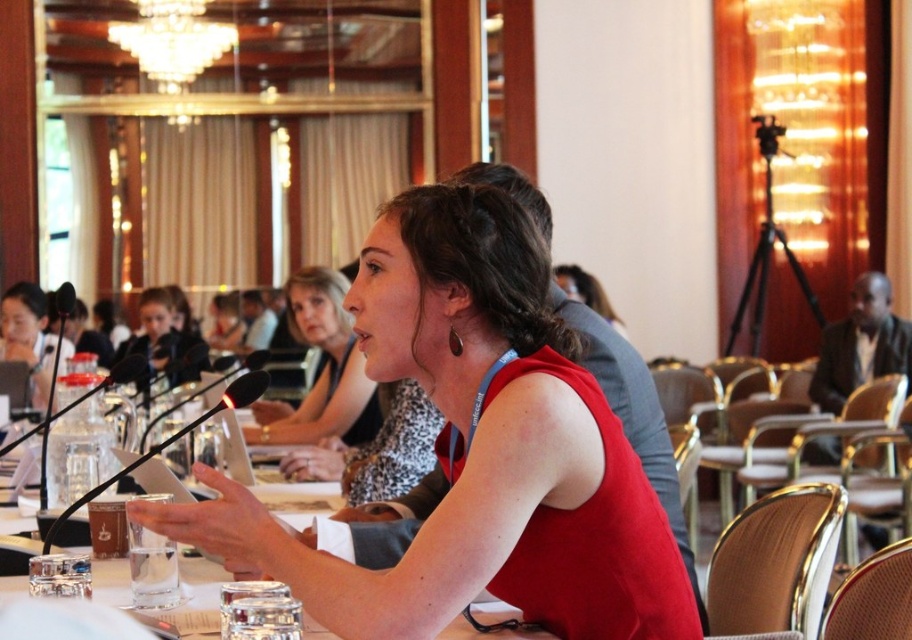
Image resolution: width=912 pixels, height=640 pixels. What do you see at coordinates (320, 371) in the screenshot?
I see `red satin dress at center` at bounding box center [320, 371].

Which is more to the right, red satin dress at center or matte black microphone at upper left?

red satin dress at center is more to the right.

Who is more forward, (314, 268) or (161, 332)?

Positioned in front is point (314, 268).

Locate an element on the screen. This screenshot has width=912, height=640. red satin dress at center is located at coordinates (320, 371).

This screenshot has height=640, width=912. Describe the element at coordinates (475, 451) in the screenshot. I see `matte red dress at center` at that location.

Is point (530, 532) closer to viewer compared to point (308, 432)?

Yes, point (530, 532) is closer to viewer.

Is point (494, 406) more distant than point (301, 316)?

No, (494, 406) is closer to viewer.

Where is `matte red dress at center`? matte red dress at center is located at coordinates (475, 451).

Does matte red dress at center lie behind matte black microphone at upper left?

No, it is not.

What do you see at coordinates (475, 451) in the screenshot?
I see `matte red dress at center` at bounding box center [475, 451].

Which is behind, point (517, 250) or point (181, 349)?

Positioned behind is point (181, 349).

This screenshot has width=912, height=640. What are the coordinates of `matte red dress at center` in the screenshot? It's located at (475, 451).